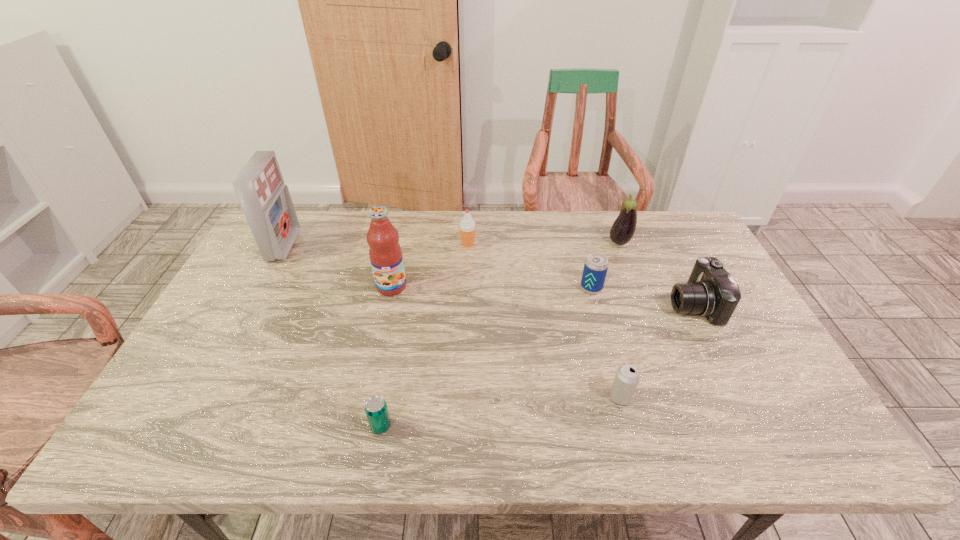
Locate an element on the screen. free space located on the front-facing side of the first-aid kit is located at coordinates (345, 246).

Locate an element on the screen. Image resolution: width=960 pixels, height=540 pixels. free space located on the front label of the fruit juice is located at coordinates (374, 363).

I want to click on free space located on the right of the seventh object from left to right, so click(703, 242).

Where is `free location located 0.360m on the front of the icecream`? The image size is (960, 540). free location located 0.360m on the front of the icecream is located at coordinates (465, 332).

The width and height of the screenshot is (960, 540). I want to click on vacant space located on the lens of the camera, so click(x=596, y=305).

Identify the location of free space located on the lens of the camera. (579, 305).

Find the location of a particular element. This screenshot has height=540, width=960. vacant area situated 0.100m on the lens of the camera is located at coordinates (635, 305).

Where is `vacant position located on the front of the farthest beer can`? The image size is (960, 540). vacant position located on the front of the farthest beer can is located at coordinates point(603,329).

The height and width of the screenshot is (540, 960). I want to click on vacant space located 0.130m on the right of the second nearest object, so click(685, 397).

Where is `vacant space located 0.180m on the right of the leftmost beer can`? vacant space located 0.180m on the right of the leftmost beer can is located at coordinates (471, 426).